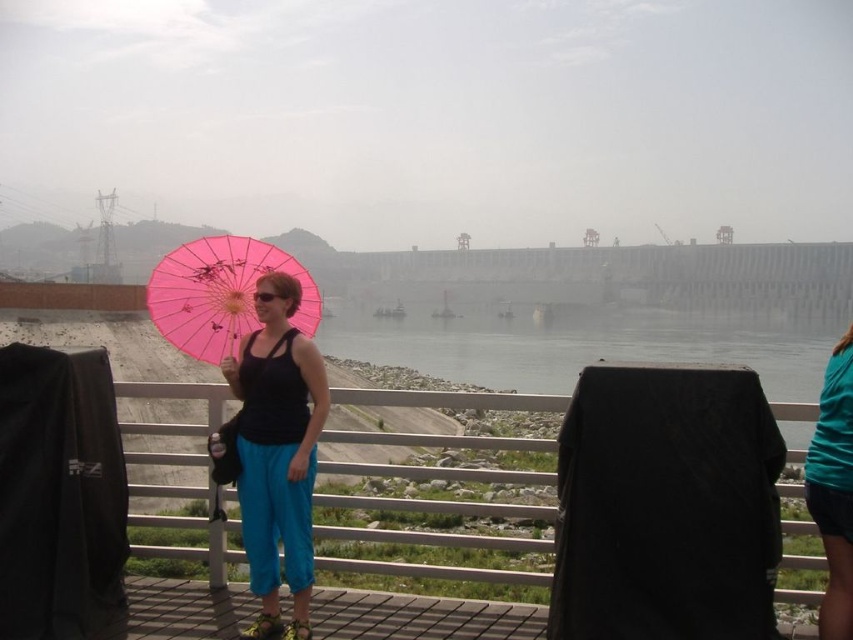
Image resolution: width=853 pixels, height=640 pixels. What do you see at coordinates (277, 451) in the screenshot?
I see `matte pink umbrella at left` at bounding box center [277, 451].

Who is higher up, matte pink umbrella at left or teal fabric shirt at right?

matte pink umbrella at left is above.

This screenshot has width=853, height=640. What do you see at coordinates (277, 451) in the screenshot?
I see `matte pink umbrella at left` at bounding box center [277, 451].

Locate an element on the screen. matte pink umbrella at left is located at coordinates (277, 451).

Between point (242, 307) and point (819, 419), which one is positioned in front?

Positioned in front is point (819, 419).

Where is `pink paper umbrella at center`? This screenshot has height=640, width=853. pink paper umbrella at center is located at coordinates point(221,292).

Does matte pink umbrella at left appear on the right side of pink paper umbrella at center?

Indeed, matte pink umbrella at left is positioned on the right side of pink paper umbrella at center.

At what (x,y) coordinates should I click in order to perform the action: click on matte pink umbrella at left. Please return your answer as a coordinate pair (x, y). Looking at the image, I should click on tap(277, 451).

In order to click on matte pink umbrella at left in this screenshot , I will do `click(277, 451)`.